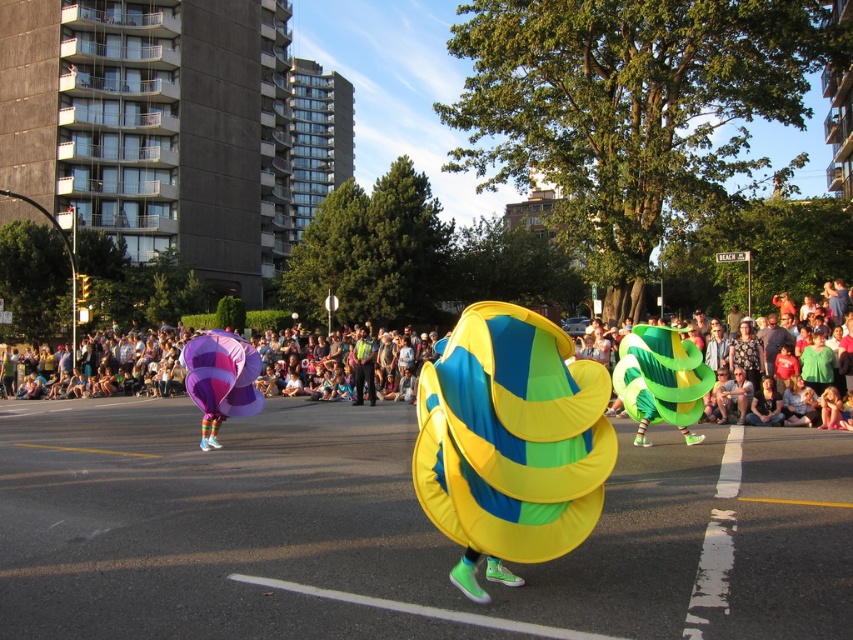
Question: Which point is farther to the camera?

Choices:
 (A) (42, 621)
 (B) (213, 392)

Answer: (B)

Question: Is yellow-green fabric balloon at center positioned in front of green matte balloon at center?

Choices:
 (A) no
 (B) yes

Answer: (B)

Question: Which point is farther from the camera taking this photo?

Choices:
 (A) (479, 346)
 (B) (668, 406)
 (C) (236, 365)
 (D) (432, 429)

Answer: (C)

Question: Observing the image, what is the correct spatial positioning of green matte balloon at center in reference to purple glossy balloon at center?

Choices:
 (A) left
 (B) right

Answer: (B)

Question: Among these objects, which one is nearest to the camera?

Choices:
 (A) purple glossy balloon at center
 (B) green matte balloon at center

Answer: (B)

Question: Does shiny yellow fabric at center have a greater width compared to yellow-green fabric balloon at center?

Choices:
 (A) yes
 (B) no

Answer: (A)